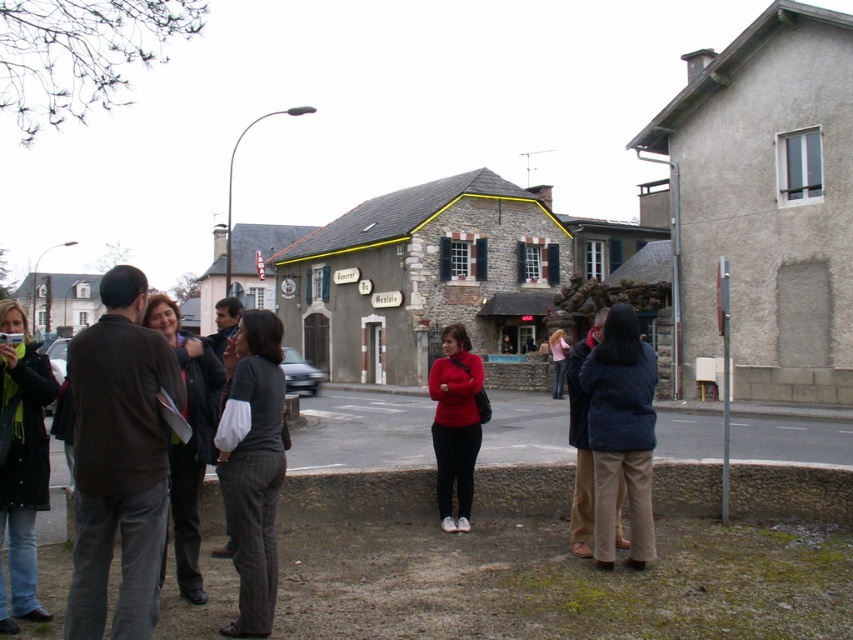
Who is positioned more to the right, dark gray pants at center or blue quilted jacket at center?

From the viewer's perspective, blue quilted jacket at center appears more on the right side.

Is dark gray pants at center to the left of blue quilted jacket at center from the viewer's perspective?

Indeed, dark gray pants at center is positioned on the left side of blue quilted jacket at center.

Is point (100, 413) farther from viewer compared to point (641, 467)?

No.

You are a GUI agent. You are given a task and a screenshot of the screen. Output one action in this format:
    pyautogui.click(x=<x>, y=<y>)
    Task: Click on the dark gray pants at center
    The width and height of the screenshot is (853, 640).
    Given the screenshot: What is the action you would take?
    pyautogui.click(x=119, y=461)

Based on the photo, is dark gray pants at center positioned in front of pink fabric shirt at center?

Yes, it is in front of pink fabric shirt at center.

Is the position of dark gray pants at center more distant than that of pink fabric shirt at center?

No.

This screenshot has height=640, width=853. I want to click on dark gray pants at center, so (119, 461).

I want to click on dark gray pants at center, so click(x=119, y=461).

Measure the distance from dark brown jacket at left to jeans at left.

dark brown jacket at left and jeans at left are 92.53 centimeters apart.

At what (x,y) coordinates should I click in order to perform the action: click on dark brown jacket at left. Please return your answer as a coordinate pair (x, y). This screenshot has width=853, height=640. Looking at the image, I should click on [119, 460].

Who is more distant from viewer, (143, 349) or (35, 417)?

Positioned behind is point (35, 417).

Locate an element on the screen. dark brown jacket at left is located at coordinates (119, 460).